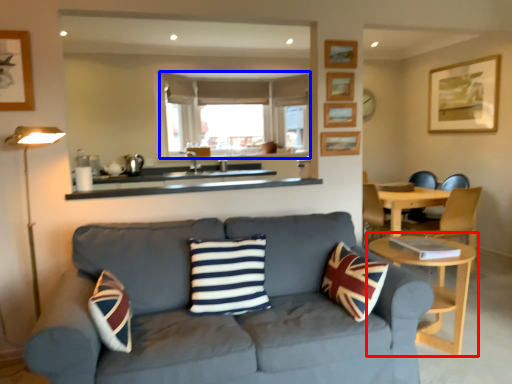
Question: Which object is further to the camera taking this photo, table (highlighted by a red box) or window frame (highlighted by a blue box)?

Choices:
 (A) table
 (B) window frame

Answer: (B)